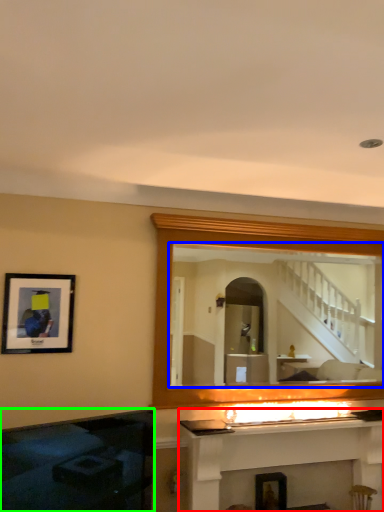
Question: Which object is positioned closest to fireplace (highlighted by a red box)? Select from mirror (highlighted by a blue box) and fireplace (highlighted by a green box).

Choices:
 (A) mirror
 (B) fireplace

Answer: (B)